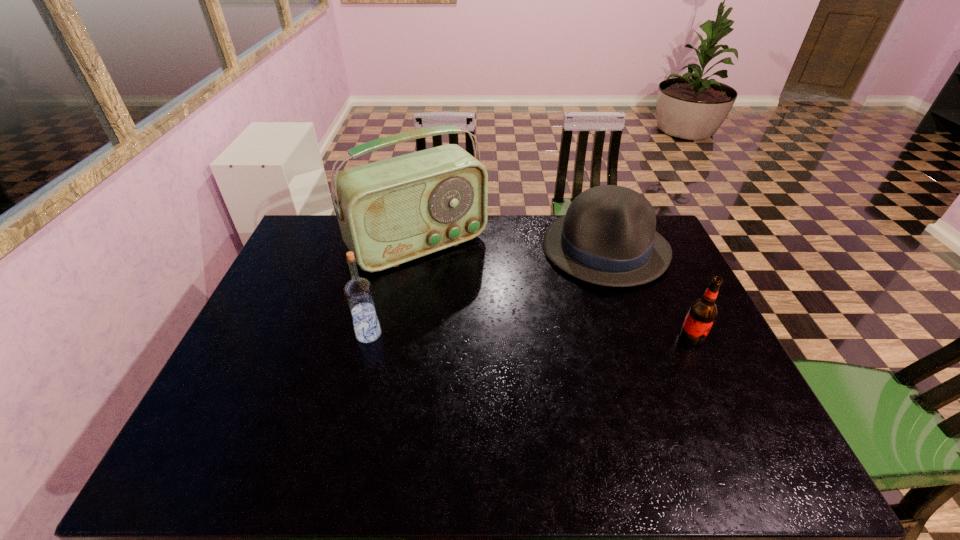
Where is `vacant spot on the desktop that is between the second tallest object and the root beer and is positioned on the front-facing side of the bowler hat`? vacant spot on the desktop that is between the second tallest object and the root beer and is positioned on the front-facing side of the bowler hat is located at coordinates (575, 336).

In order to click on vacant space on the desktop that is between the second tallest object and the root beer and is positioned on the front panel of the radio receiver in this screenshot , I will do `click(492, 335)`.